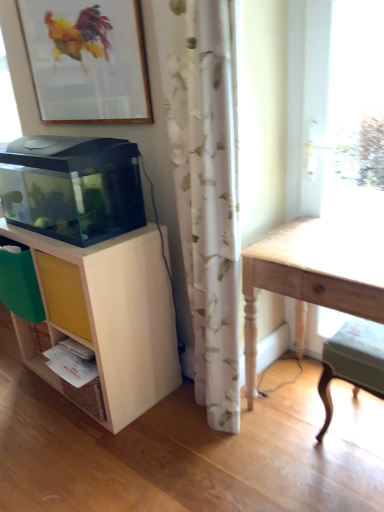
Find the location of a particular element. vacant space to the left of light green fabric step stool at lower right is located at coordinates (295, 440).